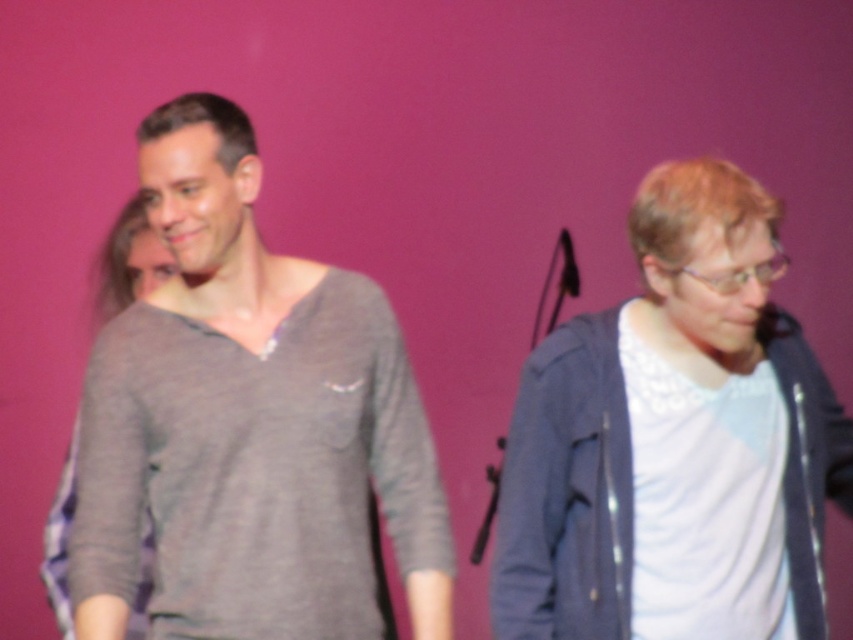
In the scene shown: You are organizing a photoshoot and need to ensure that the gray cotton shirt at left and the white matte jacket at right are visible in the final image. Based on their positions, which clothing item is closer to the camera?

The gray cotton shirt at left is closer to the camera since it is in front of the white matte jacket at right.

You are organizing a clothing donation drive and need to determine if the white matte jacket at right and the matte gray sweater at left can fit into a standard donation box that measures 30x30x30 cm. Based on their sizes, will both items fit comfortably inside?

The white matte jacket at right is larger in size than the matte gray sweater at left. Since the jacket is larger, it might not fit comfortably into the standard donation box that measures 30x30x30 cm. The sweater may fit, but the jacket might be too big.

You are a photographer setting up for a photoshoot. You notice the white matte jacket at right and the matte gray sweater at left in the frame. Which clothing item is closer to the camera?

The white matte jacket at right is closer to the camera because it is in front of the matte gray sweater at left.